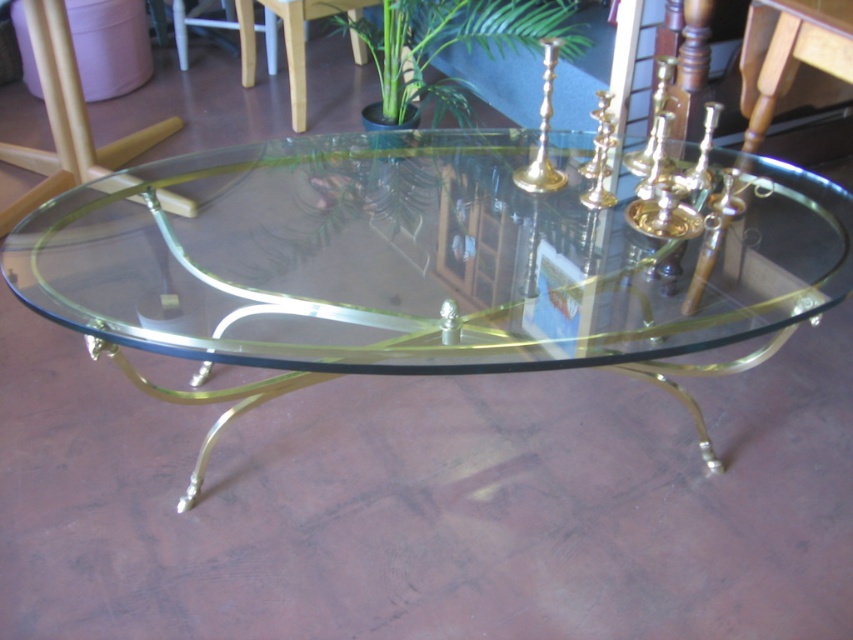
Does transparent glass table at center have a greater width compared to green leafy plant at upper center?

Yes, transparent glass table at center is wider than green leafy plant at upper center.

Can you confirm if transparent glass table at center is positioned above green leafy plant at upper center?

Actually, transparent glass table at center is below green leafy plant at upper center.

The image size is (853, 640). What are the coordinates of `transparent glass table at center` in the screenshot? It's located at 421,264.